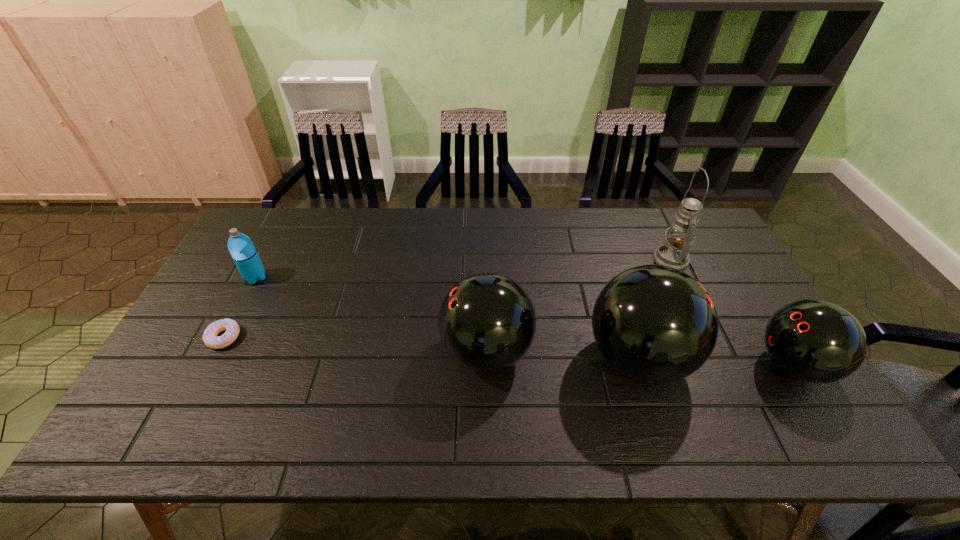
Locate an element on the screen. vacant space in between the leftmost bowling ball and the thermos bottle is located at coordinates (372, 315).

Locate an element on the screen. This screenshot has height=540, width=960. free space that is in between the doughnut and the leftmost bowling ball is located at coordinates (355, 345).

Where is `vacant area between the leftmost bowling ball and the thermos bottle`? This screenshot has width=960, height=540. vacant area between the leftmost bowling ball and the thermos bottle is located at coordinates (372, 315).

Image resolution: width=960 pixels, height=540 pixels. What are the coordinates of `free point between the second shortest bowling ball and the shortest object` in the screenshot? It's located at (355, 345).

The image size is (960, 540). I want to click on vacant space that's between the leftmost bowling ball and the third object from right to left, so click(x=563, y=355).

The width and height of the screenshot is (960, 540). Find the location of `free space between the third object from left to right and the third object from right to left`. free space between the third object from left to right and the third object from right to left is located at coordinates (563, 355).

This screenshot has width=960, height=540. I want to click on object that is the fifth closest to the second object from right to left, so click(210, 338).

Choose which object is the fifth nearest neighbor to the third object from right to left. Please provide its 2D coordinates. Your answer should be formatted as a tuple, i.e. [(x, y)], where the tuple contains the x and y coordinates of a point satisfying the conditions above.

[(241, 248)]

At what (x,y) coordinates should I click in order to perform the action: click on bowling ball that is the closest to the oil lamp. Please return your answer as a coordinate pair (x, y). This screenshot has width=960, height=540. Looking at the image, I should click on (656, 324).

Locate an element on the screen. The image size is (960, 540). bowling ball that can be found as the second closest to the second tallest bowling ball is located at coordinates [815, 341].